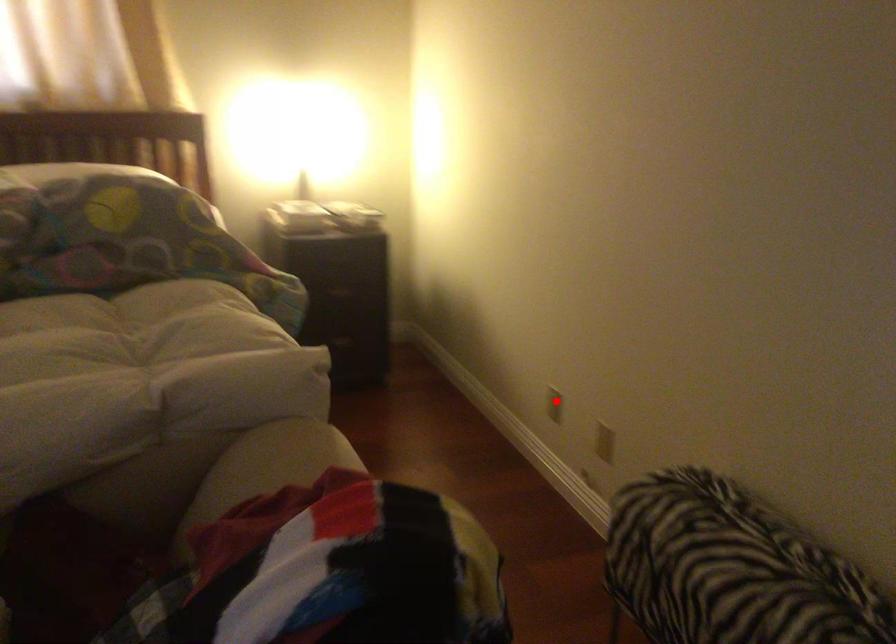
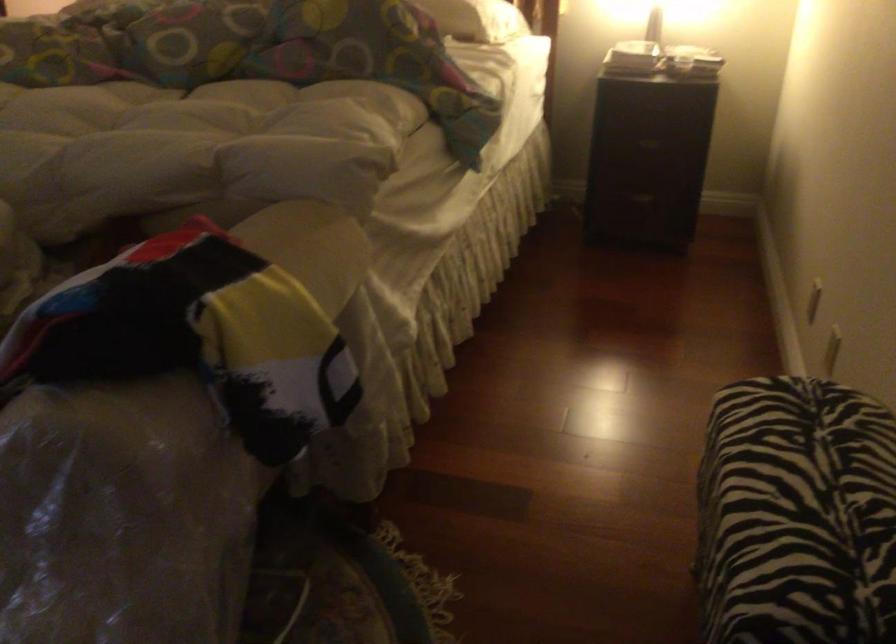
Question: I am providing you with two images of the same scene from different viewpoints. Given a red point in image1, look at the same physical point in image2. Is it:

Choices:
 (A) Closer to the viewpoint
 (B) Farther from the viewpoint

Answer: (A)